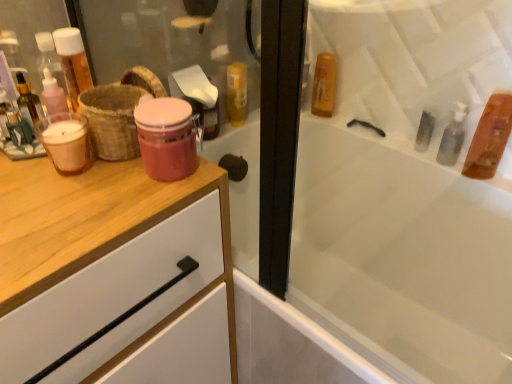
The image size is (512, 384). What are the coordinates of `matte pink glass jar at center, the 1th mouthwash positioned from the front` in the screenshot? It's located at (166, 138).

In order to face translucent amber liquid at upper right, marked as the fourth mouthwash in a front-to-back arrangement, should I rotate leftwards or rightwards?

To align with it, rotate right about 9.526°.

What do you see at coordinates (324, 85) in the screenshot? I see `translucent amber liquid at upper right, marked as the 3th mouthwash in a left-to-right arrangement` at bounding box center [324, 85].

Measure the distance between translucent glass mouthwash at left, which ranks as the 4th mouthwash in right-to-left order, and camera.

The distance of translucent glass mouthwash at left, which ranks as the 4th mouthwash in right-to-left order, from camera is 25.72 inches.

What do you see at coordinates (402, 258) in the screenshot? I see `white glossy bathtub at upper right` at bounding box center [402, 258].

What are the coordinates of `matte pink glass jar at center, the 3th mouthwash from the right` in the screenshot? It's located at (166, 138).

Is matte pink glass jar at center, which is the 4th mouthwash from back to front, inside or outside of brown woven basket at left?

matte pink glass jar at center, which is the 4th mouthwash from back to front, cannot be found inside brown woven basket at left.

From the image's perspective, starting from the brown woven basket at left, which mouthwash is the 1st one below? Please provide its 2D coordinates.

[(166, 138)]

Is point (181, 162) closer to viewer compared to point (124, 98)?

Yes, point (181, 162) is closer to viewer.

In the scene shown: What's the angular difference between translucent amber liquid at upper right, marked as the 3th mouthwash in a left-to-right arrangement, and brown woven basket at left's facing directions?

The angle between the facing direction of translucent amber liquid at upper right, marked as the 3th mouthwash in a left-to-right arrangement, and the facing direction of brown woven basket at left is 85.5 degrees.

Is translucent amber liquid at upper right, marked as the 3th mouthwash in a left-to-right arrangement, with brown woven basket at left?

There is a gap between translucent amber liquid at upper right, marked as the 3th mouthwash in a left-to-right arrangement, and brown woven basket at left.

How distant is translucent amber liquid at upper right, marked as the 3th mouthwash in a left-to-right arrangement, from brown woven basket at left?

translucent amber liquid at upper right, marked as the 3th mouthwash in a left-to-right arrangement, is 29.09 inches from brown woven basket at left.

Is translucent amber liquid at upper right, marked as the 3th mouthwash in a left-to-right arrangement, inside the boundaries of brown woven basket at left, or outside?

translucent amber liquid at upper right, marked as the 3th mouthwash in a left-to-right arrangement, is located beyond the bounds of brown woven basket at left.

Relative to matte pink glass jar at center, the 1th mouthwash positioned from the front, is white glossy bathtub at upper right in front or behind?

In the image, white glossy bathtub at upper right appears in front of matte pink glass jar at center, the 1th mouthwash positioned from the front.

From a real-world perspective, is white glossy bathtub at upper right positioned over matte pink glass jar at center, the 1th mouthwash positioned from the front, based on gravity?

Actually, white glossy bathtub at upper right is physically below matte pink glass jar at center, the 1th mouthwash positioned from the front, in the real world.

Which of these two, white glossy bathtub at upper right or matte pink glass jar at center, the 3th mouthwash from the right, is bigger?

Bigger between the two is white glossy bathtub at upper right.

Image resolution: width=512 pixels, height=384 pixels. I want to click on bathtub lying on the right of matte pink glass jar at center, acting as the 2th mouthwash starting from the left, so click(402, 258).

How far apart are white glossy bathtub at upper right and brown woven basket at left?

white glossy bathtub at upper right is 76.12 centimeters away from brown woven basket at left.

Considering the relative sizes of white glossy bathtub at upper right and brown woven basket at left in the image provided, is white glossy bathtub at upper right wider than brown woven basket at left?

Indeed, white glossy bathtub at upper right has a greater width compared to brown woven basket at left.

Can you confirm if white glossy bathtub at upper right is positioned to the right of brown woven basket at left?

Yes.

Between white glossy bathtub at upper right and brown woven basket at left, which one has smaller size?

brown woven basket at left.

How different are the orientations of translucent amber liquid at upper right, the 3th mouthwash viewed from the front, and matte pink glass jar at center, the 1th mouthwash positioned from the front, in degrees?

translucent amber liquid at upper right, the 3th mouthwash viewed from the front, and matte pink glass jar at center, the 1th mouthwash positioned from the front, are facing 85.5 degrees away from each other.

From a real-world perspective, is translucent amber liquid at upper right, the second mouthwash in the back-to-front sequence, over matte pink glass jar at center, the 1th mouthwash positioned from the front?

No, from a real-world perspective, translucent amber liquid at upper right, the second mouthwash in the back-to-front sequence, is not on top of matte pink glass jar at center, the 1th mouthwash positioned from the front.

Is translucent amber liquid at upper right, which appears as the 4th mouthwash when viewed from the left, turned away from matte pink glass jar at center, acting as the 2th mouthwash starting from the left?

translucent amber liquid at upper right, which appears as the 4th mouthwash when viewed from the left, is not turned away from matte pink glass jar at center, acting as the 2th mouthwash starting from the left.

Is translucent amber liquid at upper right, the second mouthwash in the back-to-front sequence, beside matte pink glass jar at center, the 3th mouthwash from the right?

No, translucent amber liquid at upper right, the second mouthwash in the back-to-front sequence, is not next to matte pink glass jar at center, the 3th mouthwash from the right.

Are white glossy bathtub at upper right and translucent glass mouthwash at left, the third mouthwash when ordered from back to front, making contact?

There is a gap between white glossy bathtub at upper right and translucent glass mouthwash at left, the third mouthwash when ordered from back to front.

Which of these two, white glossy bathtub at upper right or translucent glass mouthwash at left, the 2th mouthwash when ordered from front to back, is thinner?

translucent glass mouthwash at left, the 2th mouthwash when ordered from front to back, is thinner.

Does point (416, 176) appear closer or farther from the camera than point (74, 139)?

Point (416, 176) is positioned farther from the camera compared to point (74, 139).

Which object is closer to the camera taking this photo, white glossy bathtub at upper right or translucent glass mouthwash at left, which ranks as the 4th mouthwash in right-to-left order?

white glossy bathtub at upper right is in front.

Is translucent glass mouthwash at left, which ranks as the 4th mouthwash in right-to-left order, aimed at white glossy bathtub at upper right?

No, translucent glass mouthwash at left, which ranks as the 4th mouthwash in right-to-left order, is not turned towards white glossy bathtub at upper right.

Can you confirm if translucent glass mouthwash at left, the 2th mouthwash when ordered from front to back, is shorter than white glossy bathtub at upper right?

Yes.

Visually, is translucent glass mouthwash at left, the 2th mouthwash when ordered from front to back, positioned to the left or to the right of white glossy bathtub at upper right?

Based on their positions, translucent glass mouthwash at left, the 2th mouthwash when ordered from front to back, is located to the left of white glossy bathtub at upper right.

Between translucent glass mouthwash at left, the third mouthwash when ordered from back to front, and white glossy bathtub at upper right, which one has larger size?

With larger size is white glossy bathtub at upper right.

At what (x,y) coordinates should I click in order to perform the action: click on basket located on the left of matte pink glass jar at center, the 3th mouthwash from the right. Please return your answer as a coordinate pair (x, y). Looking at the image, I should click on (118, 113).

From a real-world perspective, starting from the brown woven basket at left, which mouthwash is the 3rd one below it? Please provide its 2D coordinates.

[(324, 85)]

When comparing their distances from translucent glass mouthwash at left, the third mouthwash when ordered from back to front, does translucent amber liquid at upper right, the 3th mouthwash viewed from the front, or brown woven basket at left seem closer?

brown woven basket at left lies closer to translucent glass mouthwash at left, the third mouthwash when ordered from back to front, than the other object.

Estimate the real-world distances between objects in this image. Which object is further from brown woven basket at left, translucent glass mouthwash at left, the first mouthwash positioned from the left, or translucent amber liquid at upper right, the 3th mouthwash viewed from the front?

translucent amber liquid at upper right, the 3th mouthwash viewed from the front.

From the image, which object appears to be nearer to translucent glass mouthwash at left, the third mouthwash when ordered from back to front, matte pink glass jar at center, acting as the 2th mouthwash starting from the left, or translucent amber liquid at upper right, the 3th mouthwash viewed from the front?

The object closer to translucent glass mouthwash at left, the third mouthwash when ordered from back to front, is matte pink glass jar at center, acting as the 2th mouthwash starting from the left.

Considering their positions, is white glossy bathtub at upper right positioned closer to translucent amber liquid at upper right, which appears as the 4th mouthwash when viewed from the left, than brown woven basket at left?

white glossy bathtub at upper right is closer to translucent amber liquid at upper right, which appears as the 4th mouthwash when viewed from the left.

In the scene shown: Looking at the image, which one is located closer to brown woven basket at left, translucent amber liquid at upper right, placed as the first mouthwash when sorted from back to front, or translucent amber liquid at upper right, the second mouthwash in the back-to-front sequence?

translucent amber liquid at upper right, placed as the first mouthwash when sorted from back to front, lies closer to brown woven basket at left than the other object.

From the image, which object appears to be farther from translucent amber liquid at upper right, placed as the first mouthwash when sorted from back to front, translucent amber liquid at upper right, which is counted as the 1th mouthwash, starting from the right, or white glossy bathtub at upper right?

Based on the image, translucent amber liquid at upper right, which is counted as the 1th mouthwash, starting from the right, appears to be further to translucent amber liquid at upper right, placed as the first mouthwash when sorted from back to front.

Considering their positions, is translucent amber liquid at upper right, marked as the 3th mouthwash in a left-to-right arrangement, positioned further to translucent amber liquid at upper right, which is counted as the 1th mouthwash, starting from the right, than brown woven basket at left?

brown woven basket at left is further to translucent amber liquid at upper right, which is counted as the 1th mouthwash, starting from the right.

From the image, which object appears to be farther from translucent amber liquid at upper right, which appears as the 4th mouthwash when viewed from the left, translucent amber liquid at upper right, marked as the fourth mouthwash in a front-to-back arrangement, or translucent glass mouthwash at left, the 2th mouthwash when ordered from front to back?

translucent glass mouthwash at left, the 2th mouthwash when ordered from front to back.

This screenshot has width=512, height=384. In order to click on basket between translucent glass mouthwash at left, which ranks as the 4th mouthwash in right-to-left order, and matte pink glass jar at center, acting as the 2th mouthwash starting from the left, from left to right in this screenshot , I will do `click(118, 113)`.

Identify the location of basket between matte pink glass jar at center, the 3th mouthwash from the right, and translucent amber liquid at upper right, marked as the 3th mouthwash in a left-to-right arrangement, along the z-axis. (118, 113).

At what (x,y) coordinates should I click in order to perform the action: click on bathtub situated between brown woven basket at left and translucent amber liquid at upper right, the 3th mouthwash viewed from the front, from left to right. Please return your answer as a coordinate pair (x, y). This screenshot has width=512, height=384. Looking at the image, I should click on (402, 258).

The width and height of the screenshot is (512, 384). Identify the location of basket situated between translucent glass mouthwash at left, the 2th mouthwash when ordered from front to back, and translucent amber liquid at upper right, which is counted as the 1th mouthwash, starting from the right, from left to right. (118, 113).